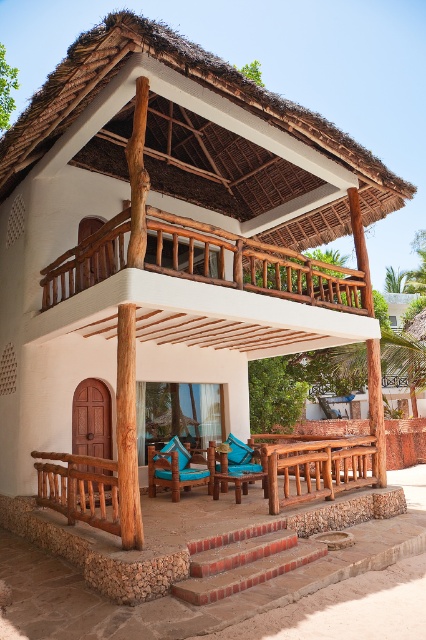
Is wooden at upper center smaller than brick stairs at lower center?

No.

Is wooden at upper center to the left of brick stairs at lower center from the viewer's perspective?

No, wooden at upper center is not to the left of brick stairs at lower center.

Between point (236, 336) and point (252, 580), which one is positioned behind?

Positioned behind is point (236, 336).

I want to click on wooden at upper center, so click(x=249, y=264).

Is brick stairs at lower center to the right of brown wooden bench at lower center from the viewer's perspective?

In fact, brick stairs at lower center is to the left of brown wooden bench at lower center.

The width and height of the screenshot is (426, 640). In order to click on brick stairs at lower center in this screenshot , I will do `click(242, 561)`.

Locate an element on the screen. The width and height of the screenshot is (426, 640). brick stairs at lower center is located at coordinates pos(242,561).

The height and width of the screenshot is (640, 426). What are the coordinates of `brick stairs at lower center` in the screenshot? It's located at (242, 561).

Can you confirm if wooden at upper center is positioned above brown wooden bench at lower center?

Yes.

Does wooden at upper center have a greater height compared to brown wooden bench at lower center?

Yes, wooden at upper center is taller than brown wooden bench at lower center.

Describe the element at coordinates (249, 264) in the screenshot. The height and width of the screenshot is (640, 426). I see `wooden at upper center` at that location.

This screenshot has width=426, height=640. Find the location of `wooden at upper center`. wooden at upper center is located at coordinates pos(249,264).